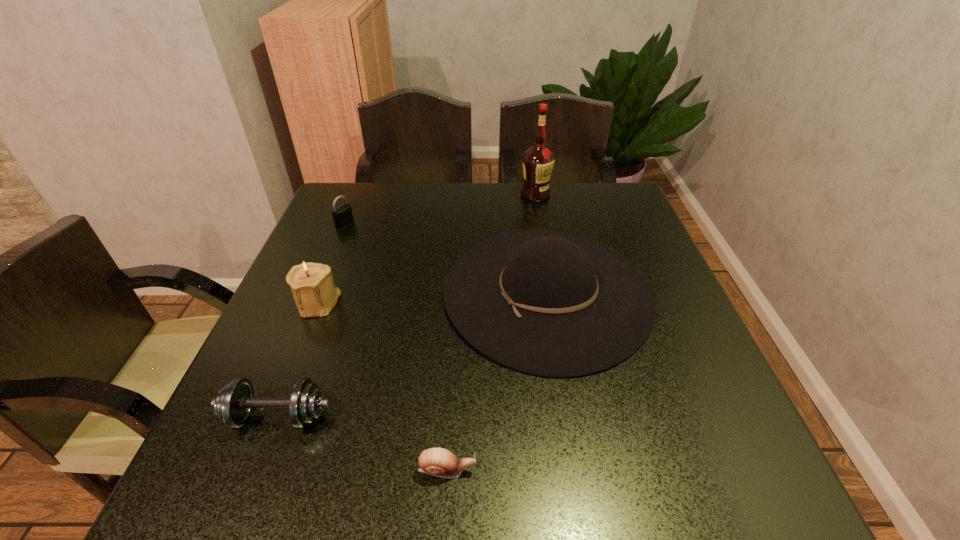
Find the location of a particular element. the tallest object is located at coordinates (538, 160).

This screenshot has width=960, height=540. Find the location of `the farthest object`. the farthest object is located at coordinates (538, 160).

The width and height of the screenshot is (960, 540). In order to click on sombrero in this screenshot , I will do `click(548, 303)`.

The image size is (960, 540). In order to click on candle_holder in this screenshot , I will do `click(312, 285)`.

Find the location of a particular element. padlock is located at coordinates (342, 216).

At what (x,y) coordinates should I click in order to perform the action: click on the fifth farthest object. Please return your answer as a coordinate pair (x, y). This screenshot has height=540, width=960. Looking at the image, I should click on pos(233,404).

At what (x,y) coordinates should I click in order to perform the action: click on the shortest object. Please return your answer as a coordinate pair (x, y). Looking at the image, I should click on (436, 461).

Locate an element on the screen. Image resolution: width=960 pixels, height=540 pixels. escargot is located at coordinates 436,461.

Identify the location of vacant space located on the label of the farthest object. The width and height of the screenshot is (960, 540). (551, 279).

Where is `vacant space positioned 0.070m on the front-facing side of the sombrero`? vacant space positioned 0.070m on the front-facing side of the sombrero is located at coordinates (413, 293).